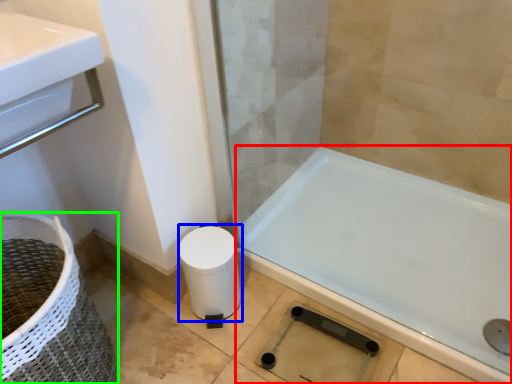
Question: Which is nearer to the bathtub (highlighted by a red box)? toilet paper (highlighted by a blue box) or basket container (highlighted by a green box).

Choices:
 (A) toilet paper
 (B) basket container

Answer: (A)